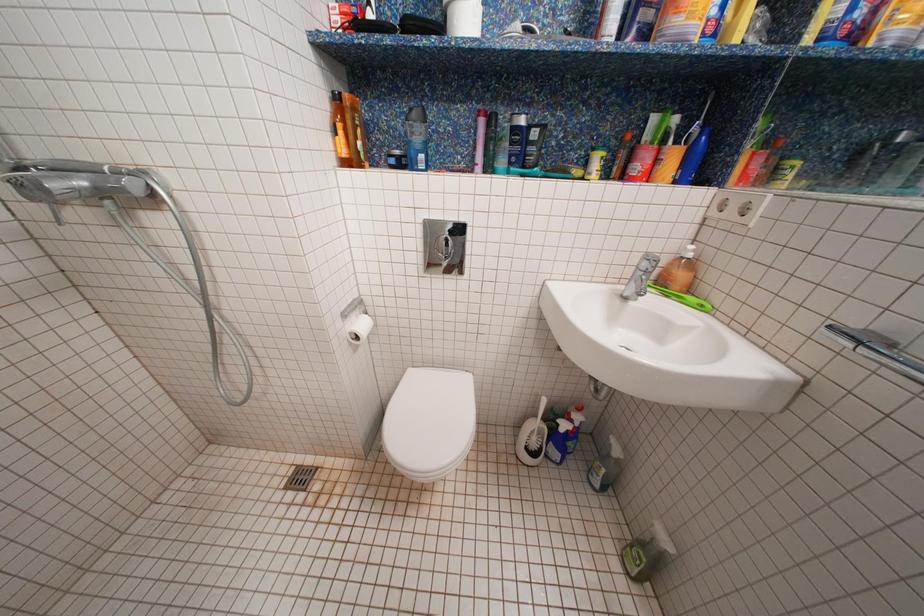
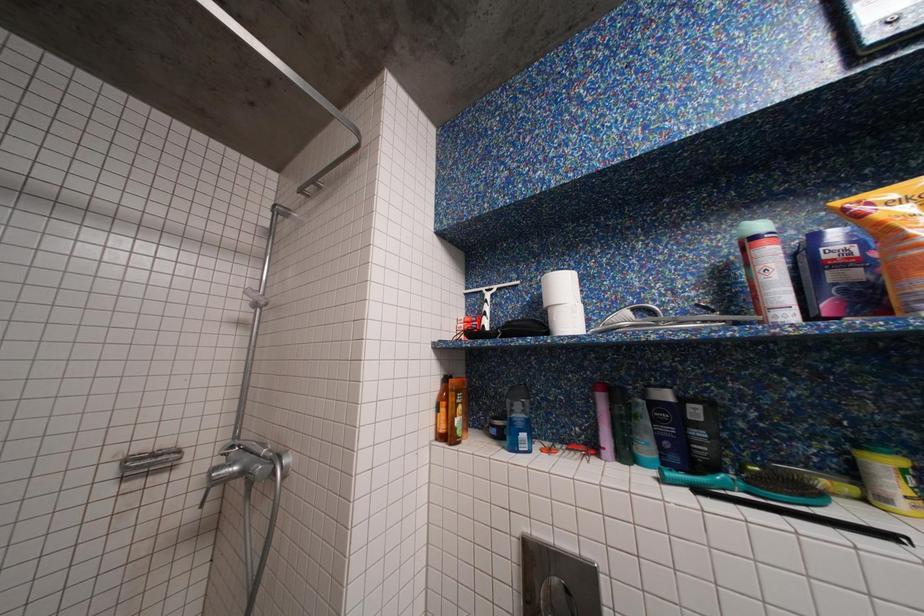
How did the camera likely rotate?

The rotation direction of the camera is left-up.